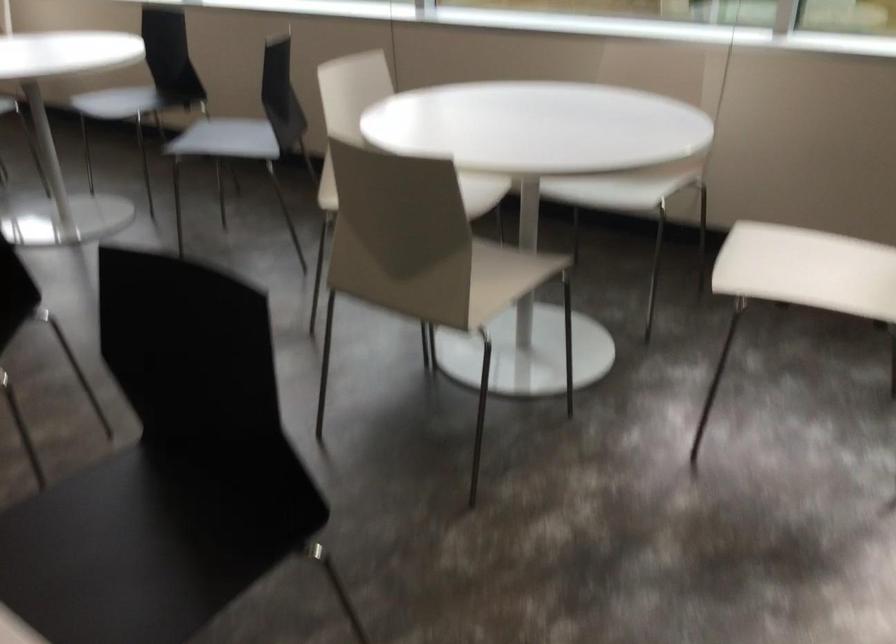
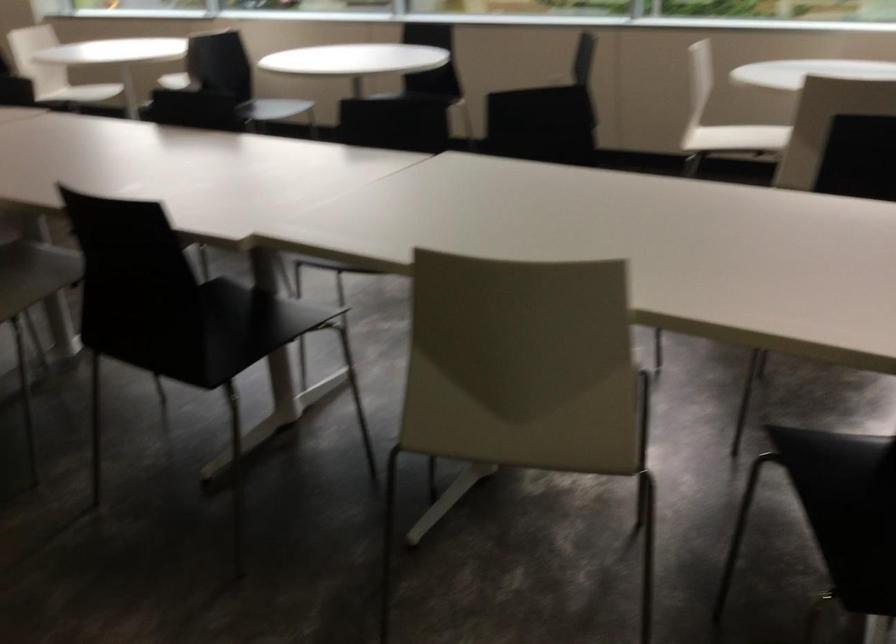
In a continuous first-person perspective shot, in which direction is the camera moving?

The movement direction of the cameraman is left, backward.